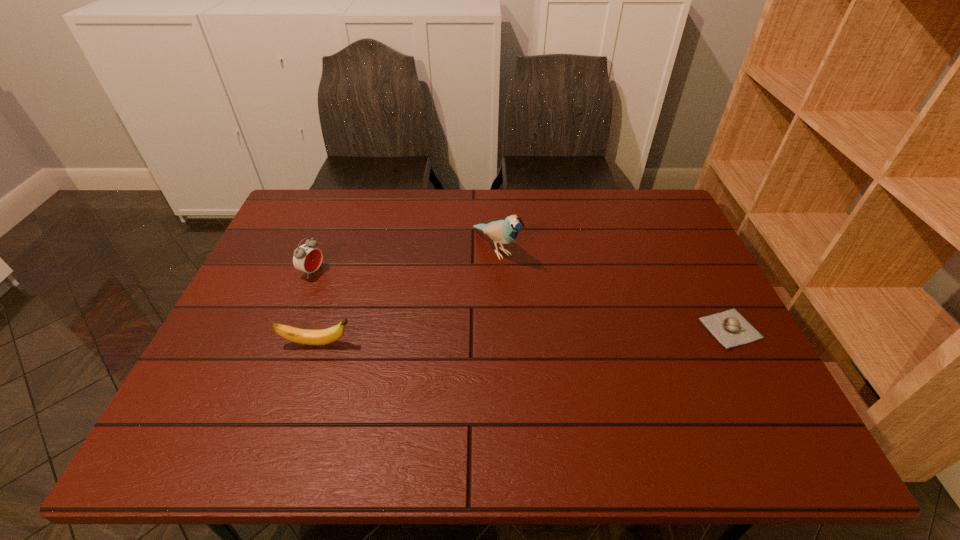
Where is `vacant space on the desktop that is between the third tallest object and the shortest object and is positioned on the face of the third shortest object`? This screenshot has height=540, width=960. vacant space on the desktop that is between the third tallest object and the shortest object and is positioned on the face of the third shortest object is located at coordinates (469, 338).

Find the location of a particular element. free space on the desktop that is between the third tallest object and the shortest object and is positioned at the face of the tallest object is located at coordinates 588,334.